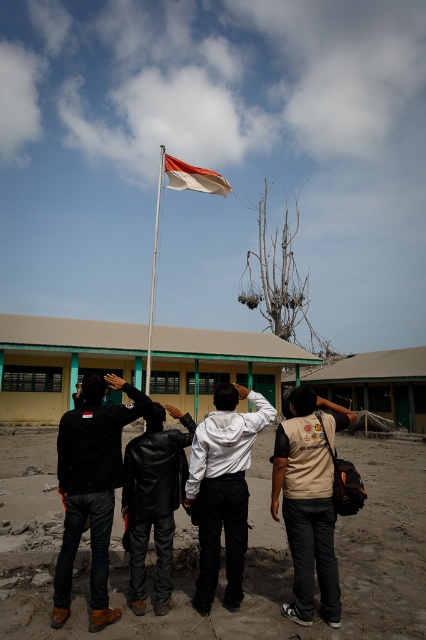
Between point (77, 445) and point (224, 522), which one is positioned in front?

Positioned in front is point (77, 445).

Describe the element at coordinates (91, 488) in the screenshot. I see `black leather jacket at left` at that location.

Who is more distant from viewer, (x=65, y=579) or (x=207, y=580)?

The point (x=207, y=580) is behind.

Find the location of a particular element. Image resolution: width=426 pixels, height=640 pixels. black leather jacket at left is located at coordinates (91, 488).

Between beige fabric shirt at center and white matte jacket at center, which one appears on the right side from the viewer's perspective?

Positioned to the right is beige fabric shirt at center.

Is point (290, 538) closer to camera compared to point (230, 513)?

Yes, point (290, 538) is closer to viewer.

Where is `beige fabric shirt at center`? beige fabric shirt at center is located at coordinates [308, 500].

Is beige fabric shirt at center below white fabric flag at upper center?

Yes.

Is beige fabric shirt at center wider than white fabric flag at upper center?

No.

Which is behind, point (294, 545) or point (170, 182)?

The point (170, 182) is more distant.

At what (x,y) coordinates should I click in order to perform the action: click on beige fabric shirt at center. Please return your answer as a coordinate pair (x, y). The height and width of the screenshot is (640, 426). Looking at the image, I should click on (308, 500).